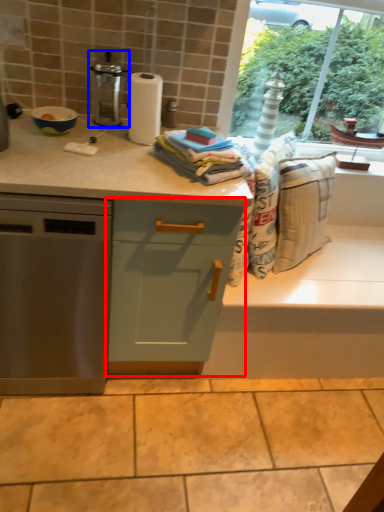
Question: Which of the following is the farthest to the observer, cabinetry (highlighted by a red box) or kitchen appliance (highlighted by a blue box)?

Choices:
 (A) cabinetry
 (B) kitchen appliance

Answer: (B)